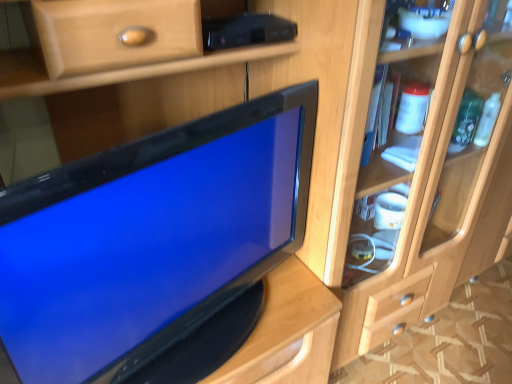
Question: Can you confirm if light wood cabinet at right is bigger than matte black tv at center?

Choices:
 (A) no
 (B) yes

Answer: (B)

Question: From the image's perspective, does light wood cabinet at right appear higher than matte black tv at center?

Choices:
 (A) no
 (B) yes

Answer: (B)

Question: Can you confirm if light wood cabinet at right is positioned to the right of matte black tv at center?

Choices:
 (A) no
 (B) yes

Answer: (B)

Question: Is light wood cabinet at right oriented away from matte black tv at center?

Choices:
 (A) yes
 (B) no

Answer: (B)

Question: From a real-world perspective, is light wood cabinet at right physically above matte black tv at center?

Choices:
 (A) no
 (B) yes

Answer: (A)

Question: Is light wood cabinet at right smaller than matte black tv at center?

Choices:
 (A) yes
 (B) no

Answer: (B)

Question: Is matte black tv at center positioned with its back to light wood cabinet at right?

Choices:
 (A) yes
 (B) no

Answer: (B)

Question: Is matte black tv at center outside of light wood cabinet at right?

Choices:
 (A) yes
 (B) no

Answer: (A)

Question: From the image's perspective, would you say matte black tv at center is shown under light wood cabinet at right?

Choices:
 (A) no
 (B) yes

Answer: (B)

Question: Considering the relative positions of matte black tv at center and light wood cabinet at right in the image provided, is matte black tv at center behind light wood cabinet at right?

Choices:
 (A) no
 (B) yes

Answer: (A)

Question: Is matte black tv at center thinner than light wood cabinet at right?

Choices:
 (A) no
 (B) yes

Answer: (B)

Question: From a real-world perspective, is matte black tv at center on top of light wood cabinet at right?

Choices:
 (A) yes
 (B) no

Answer: (A)

Question: Is point (352, 240) closer or farther from the camera than point (243, 240)?

Choices:
 (A) farther
 (B) closer

Answer: (A)